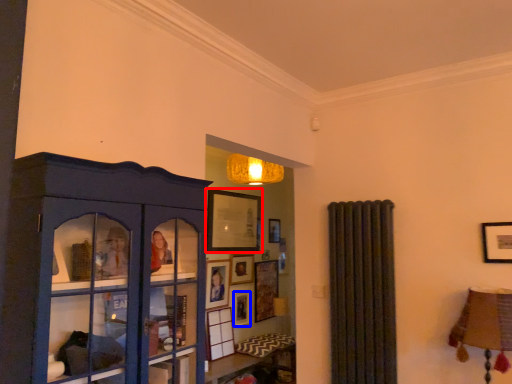
Question: Which of the following is the closest to the observer, picture frame (highlighted by a red box) or picture frame (highlighted by a blue box)?

Choices:
 (A) picture frame
 (B) picture frame

Answer: (A)